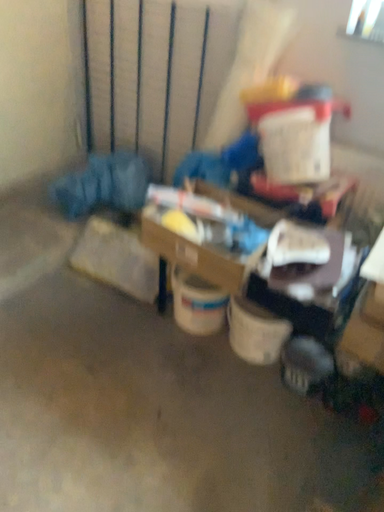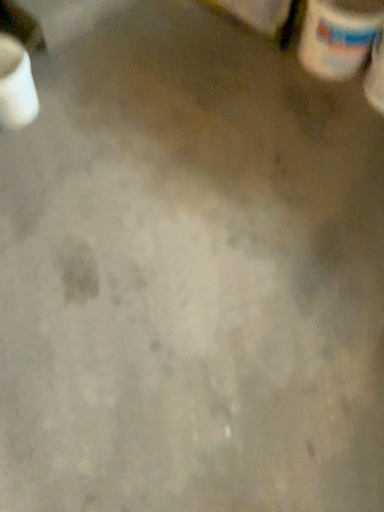
Question: Which way did the camera rotate in the video?

Choices:
 (A) rotated right
 (B) rotated left

Answer: (B)